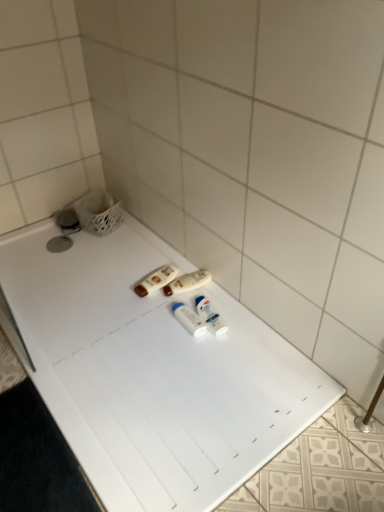
This screenshot has width=384, height=512. In order to click on unoccupied area in front of white plastic bottles at center, which is the third toiletry in right-to-left order in this screenshot , I will do pyautogui.click(x=174, y=323).